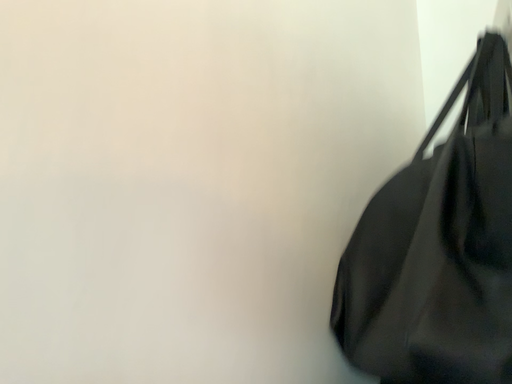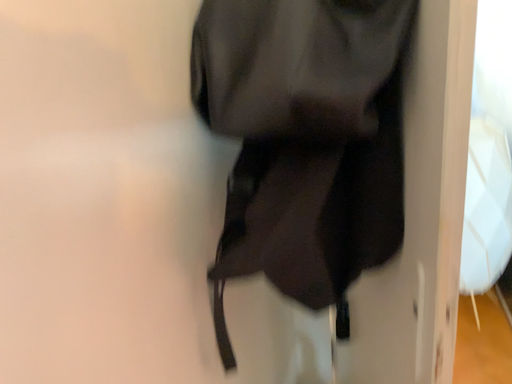
Question: Which way did the camera rotate in the video?

Choices:
 (A) rotated right
 (B) rotated left

Answer: (A)